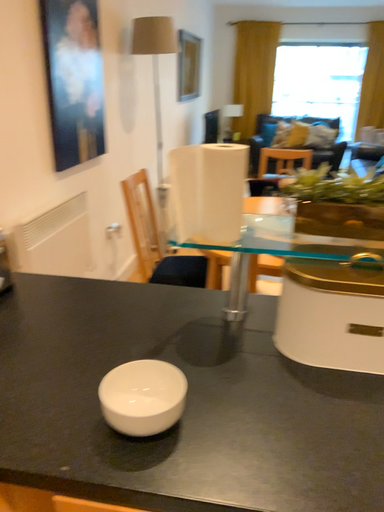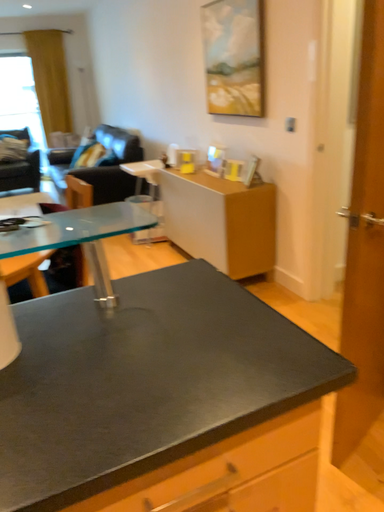
Question: Which way did the camera rotate in the video?

Choices:
 (A) rotated upward
 (B) rotated downward

Answer: (A)